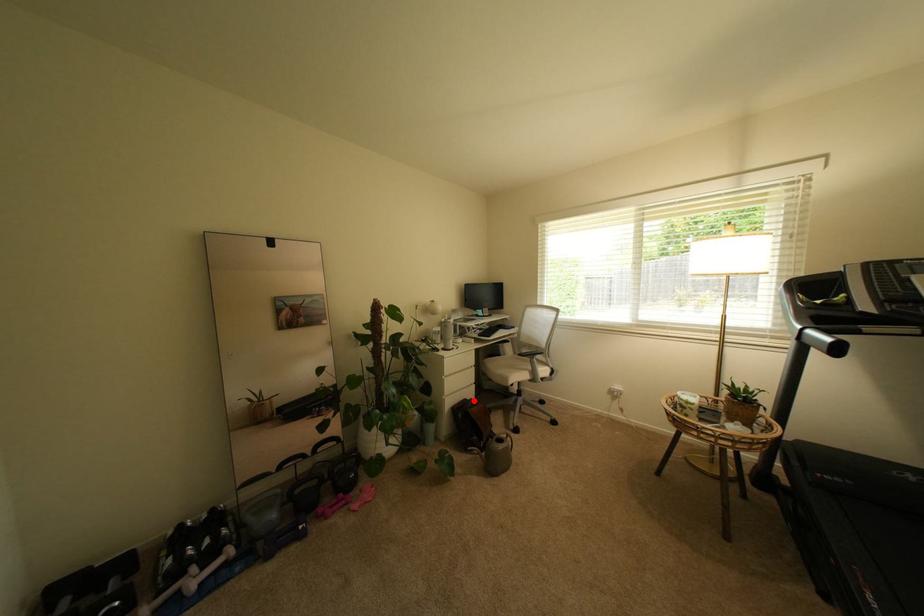
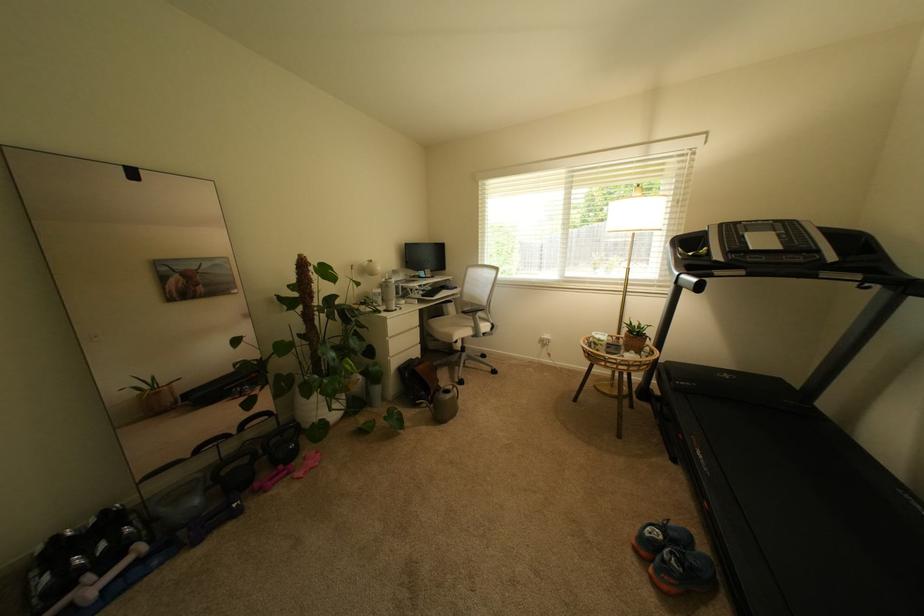
Question: I am providing you with two images of the same scene from different viewpoints. Given a red point in image1, look at the same physical point in image2. Is it:

Choices:
 (A) Closer to the viewpoint
 (B) Farther from the viewpoint

Answer: (A)